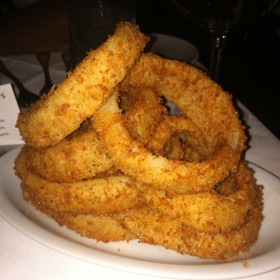
Locate an element on the screen. table cloth is located at coordinates (261, 145).